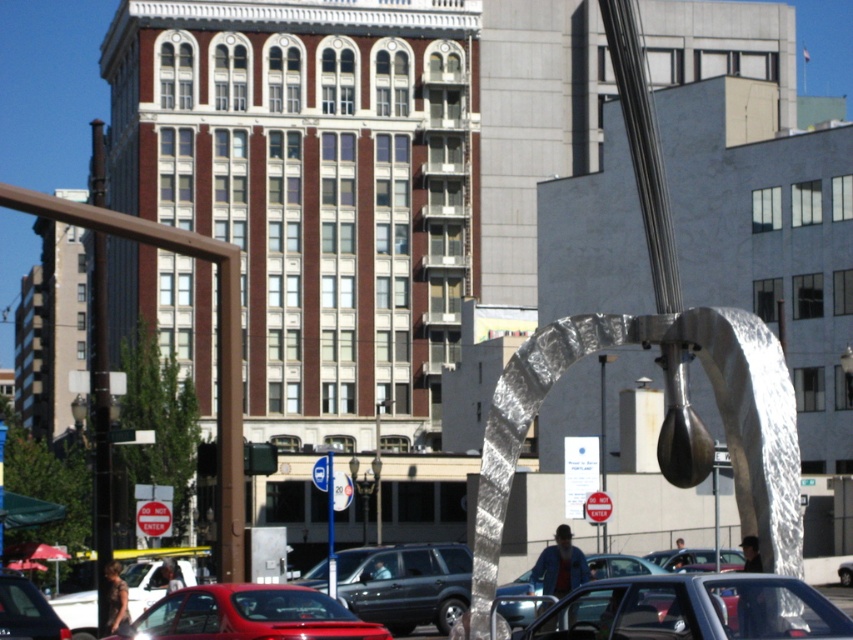
Question: Which point is closer to the camera?

Choices:
 (A) (309, 576)
 (B) (331, 451)
 (C) (16, 596)
 (D) (273, 618)

Answer: (D)

Question: Does polished silver sculpture at center appear over metallic red car at lower center?

Choices:
 (A) no
 (B) yes

Answer: (B)

Question: Which point is closer to the camera?

Choices:
 (A) matte black suv at center
 (B) brushed metal pole at center
 (C) matte red car at lower left
 (D) metallic red car at lower center

Answer: (D)

Question: Does metallic red car at lower center have a larger size compared to brushed metal pole at left?

Choices:
 (A) no
 (B) yes

Answer: (A)

Question: Which object appears farthest from the camera in this image?

Choices:
 (A) matte red car at lower left
 (B) metallic red car at lower center
 (C) brushed metal pole at left
 (D) brushed metal pole at center

Answer: (D)

Question: In this image, where is brushed metal pole at left located relative to metallic red car at lower left?

Choices:
 (A) right
 (B) left

Answer: (B)